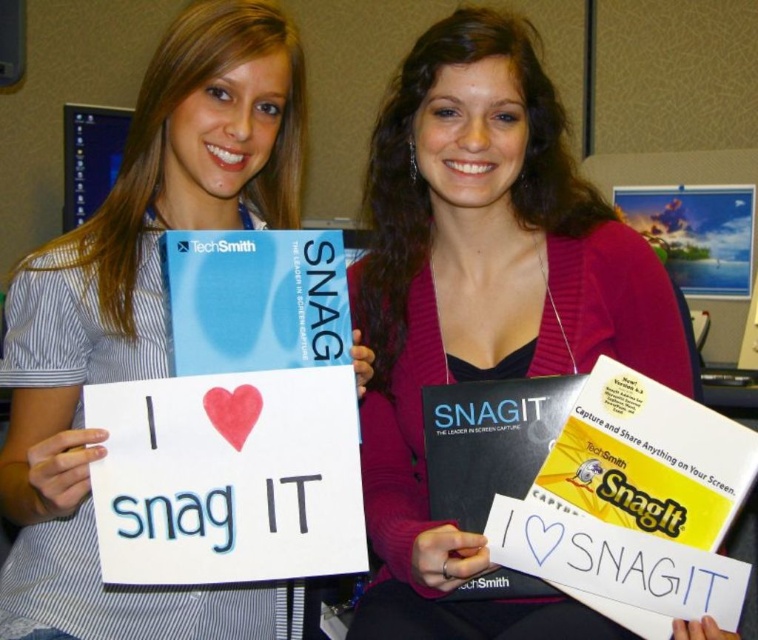
Can you confirm if matte black book at center is positioned to the left of white paper sign at center?

No, matte black book at center is not to the left of white paper sign at center.

Between matte black book at center and white paper sign at center, which one has more height?

white paper sign at center

Between point (434, 208) and point (33, 518), which one is positioned behind?

Point (434, 208)

The image size is (758, 640). Identify the location of matte black book at center. (481, 305).

Is point (211, 1) positioned behind point (644, 417)?

Yes, it is.

Is point (39, 460) in front of point (506, 557)?

Yes, it is in front of point (506, 557).

You are a GUI agent. You are given a task and a screenshot of the screen. Output one action in this format:
    pyautogui.click(x=<x>, y=<y>)
    Task: Click on the white paper sign at center
    The image size is (758, 640).
    Given the screenshot: What is the action you would take?
    pyautogui.click(x=141, y=320)

What do you see at coordinates (481, 305) in the screenshot?
I see `matte black book at center` at bounding box center [481, 305].

Can you confirm if matte black book at center is thinner than black matte book at center?

Incorrect, matte black book at center's width is not less than black matte book at center's.

Looking at this image, measure the distance between matte black book at center and camera.

matte black book at center and camera are 31.24 inches apart from each other.

Locate an element on the screen. matte black book at center is located at coordinates coord(481,305).